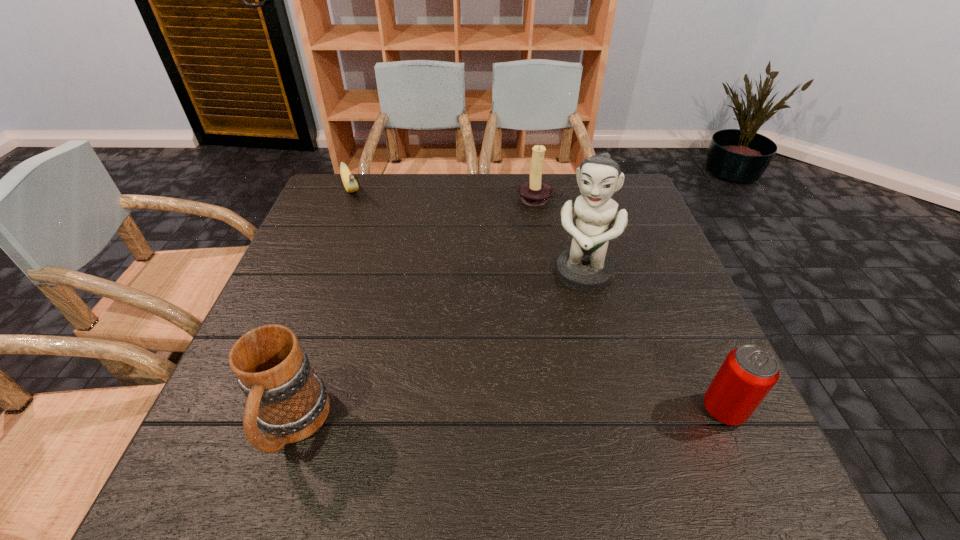
Locate an element on the screen. This screenshot has width=960, height=540. can that is at the near edge is located at coordinates (748, 373).

You are a GUI agent. You are given a task and a screenshot of the screen. Output one action in this format:
    pyautogui.click(x=<x>, y=<y>)
    Task: Click on the mug that is at the left edge
    The image size is (960, 540).
    Given the screenshot: What is the action you would take?
    pyautogui.click(x=288, y=402)

Locate an element on the screen. banana located in the left edge section of the desktop is located at coordinates (350, 184).

Find the location of a particular element. The width and height of the screenshot is (960, 540). can at the right edge is located at coordinates (748, 373).

I want to click on figurine that is positioned at the right edge, so click(585, 266).

Image resolution: width=960 pixels, height=540 pixels. Find the location of `object that is at the far left corner`. object that is at the far left corner is located at coordinates (350, 184).

Where is `object located in the near left corner section of the desktop`? object located in the near left corner section of the desktop is located at coordinates (288, 402).

The height and width of the screenshot is (540, 960). I want to click on object at the near right corner, so pyautogui.click(x=748, y=373).

In the image, there is a desktop. Identify the location of free space at the far edge. (392, 186).

Identify the location of vacant space at the near edge of the desktop. The height and width of the screenshot is (540, 960). (456, 417).